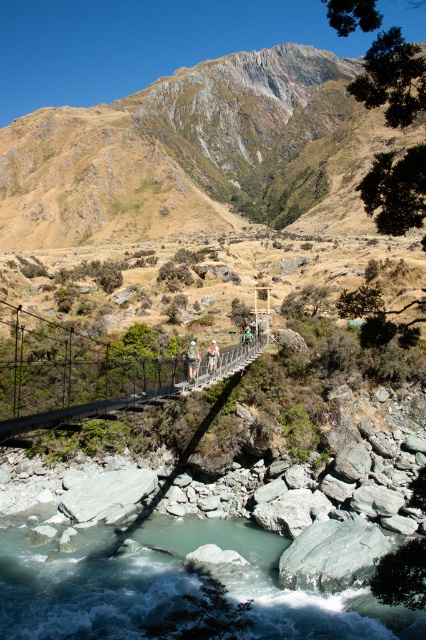
Question: Can you confirm if metallic wire bridge at center is positioned to the right of light brown fabric jacket at center?

Choices:
 (A) yes
 (B) no

Answer: (B)

Question: Which point appears closest to the camera in this image?

Choices:
 (A) (129, 392)
 (B) (190, 378)

Answer: (B)

Question: Which point is closer to the camera?

Choices:
 (A) pyautogui.click(x=247, y=333)
 (B) pyautogui.click(x=181, y=380)
 (C) pyautogui.click(x=192, y=352)

Answer: (C)

Question: Which point is closer to the camera?

Choices:
 (A) light brown fabric jacket at center
 (B) rugged brown rock at upper center

Answer: (A)

Question: Can you confirm if metallic wire bridge at center is thinner than white fabric person at center?

Choices:
 (A) yes
 (B) no

Answer: (B)

Question: Can you confirm if metallic wire bridge at center is smaller than light brown fabric jacket at center?

Choices:
 (A) yes
 (B) no

Answer: (B)